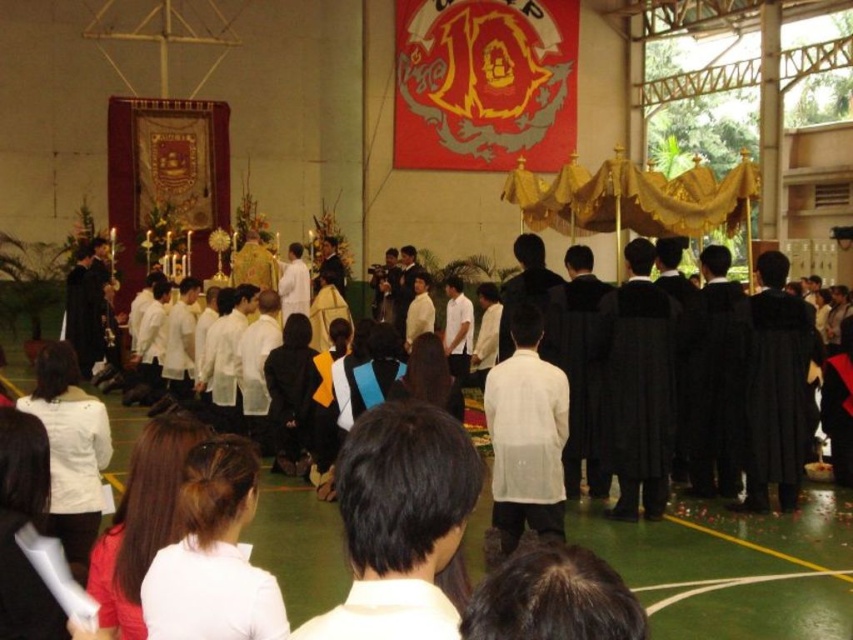
Between white matte robe at center and white matte shirt at lower center, which one appears on the left side from the viewer's perspective?

Positioned to the left is white matte shirt at lower center.

Who is more forward, (547, 490) or (264, 618)?

Point (264, 618)

Who is more distant from viewer, (x=502, y=451) or (x=207, y=605)?

The point (x=502, y=451) is behind.

Find the location of a particular element. The width and height of the screenshot is (853, 640). white matte robe at center is located at coordinates (526, 444).

Can you confirm if white matte robe at center is smaller than white matte shirt at center?

No, white matte robe at center is not smaller than white matte shirt at center.

How much distance is there between white matte robe at center and white matte shirt at center?

white matte robe at center and white matte shirt at center are 10.66 meters apart.

What do you see at coordinates (526, 444) in the screenshot? The width and height of the screenshot is (853, 640). I see `white matte robe at center` at bounding box center [526, 444].

You are a GUI agent. You are given a task and a screenshot of the screen. Output one action in this format:
    pyautogui.click(x=<x>, y=<y>)
    Task: Click on the white matte robe at center
    
    Given the screenshot: What is the action you would take?
    pyautogui.click(x=526, y=444)

Which of these two, white matte shirt at lower center or white matte shirt at center, stands taller?

white matte shirt at lower center

Can you confirm if white matte shirt at lower center is positioned to the right of white matte shirt at center?

Incorrect, white matte shirt at lower center is not on the right side of white matte shirt at center.

Between point (164, 570) and point (393, 589), which one is positioned behind?

The point (164, 570) is behind.

Find the location of a particular element. The width and height of the screenshot is (853, 640). white matte shirt at lower center is located at coordinates (210, 593).